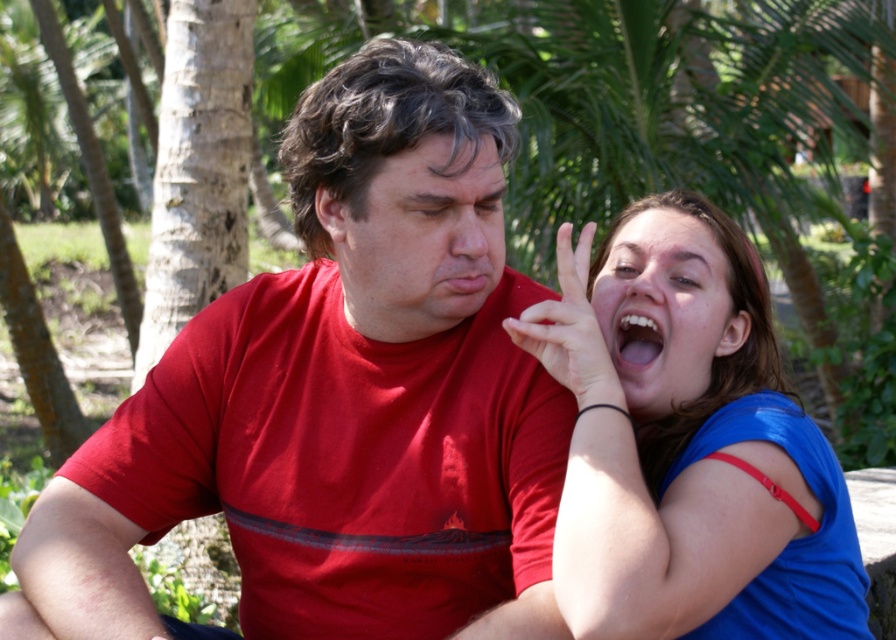
Question: Which object appears closest to the camera in this image?

Choices:
 (A) matte red t-shirt at center
 (B) blue matte face at upper right

Answer: (A)

Question: Is matte red t-shirt at center bigger than blue matte face at upper right?

Choices:
 (A) no
 (B) yes

Answer: (B)

Question: Can you confirm if matte red t-shirt at center is bigger than matte skin hand at upper right?

Choices:
 (A) yes
 (B) no

Answer: (A)

Question: Which object is positioned farthest from the blue matte face at upper right?

Choices:
 (A) matte red t-shirt at center
 (B) matte skin hand at upper right
 (C) blue shiny tank top at right

Answer: (A)

Question: Does matte red shirt at center appear over blue matte face at upper right?

Choices:
 (A) yes
 (B) no

Answer: (A)

Question: Which of these objects is positioned closest to the matte red shirt at center?

Choices:
 (A) blue shiny tank top at right
 (B) blue matte face at upper right

Answer: (A)